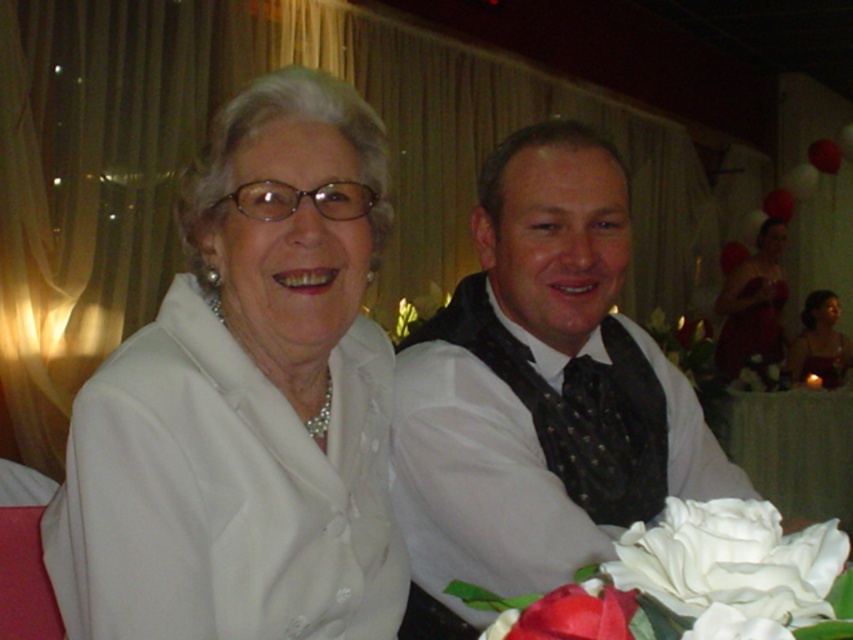
Who is positioned more to the left, white textured vest at center or matte red dress at right?

From the viewer's perspective, white textured vest at center appears more on the left side.

Between point (550, 467) and point (816, 296), which one is positioned in front?

Point (550, 467) is in front.

Is point (422, 566) more distant than point (824, 316)?

No, it is not.

Locate an element on the screen. The image size is (853, 640). white textured vest at center is located at coordinates (538, 392).

Locate an element on the screen. white satin jacket at upper left is located at coordinates (247, 403).

Does white satin jacket at upper left have a greater height compared to white textured vest at center?

In fact, white satin jacket at upper left may be shorter than white textured vest at center.

Which is behind, point (112, 461) or point (570, 467)?

The point (570, 467) is more distant.

In order to click on white satin jacket at upper left in this screenshot , I will do `click(247, 403)`.

Does point (833, 458) come in front of point (816, 310)?

That is True.

Is white fabric table at lower right further to the viewer compared to matte red dress at right?

No, it is in front of matte red dress at right.

Between point (752, 484) and point (811, 333), which one is positioned behind?

Positioned behind is point (811, 333).

Where is `white fabric table at lower right`? white fabric table at lower right is located at coordinates (793, 449).